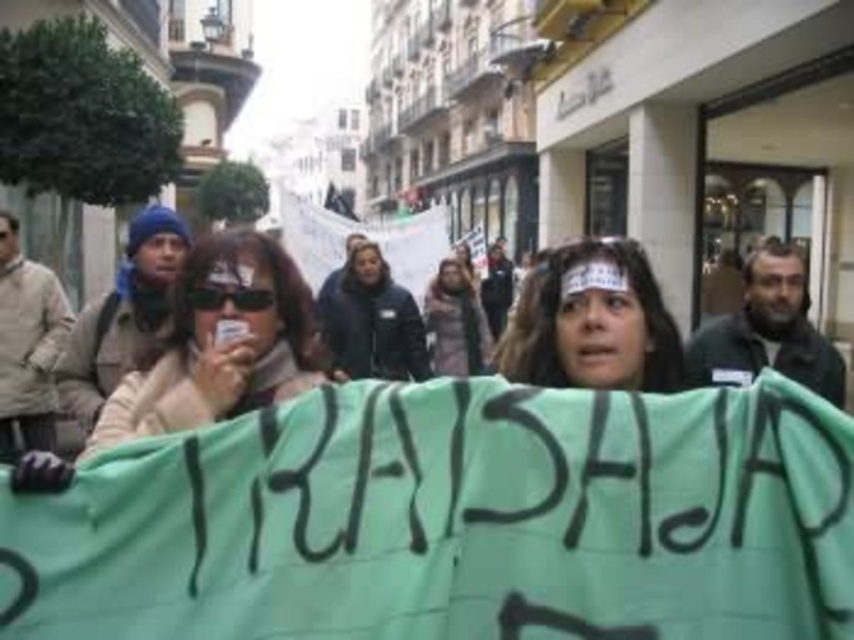
Is matte beige jacket at center further to the viewer compared to dark brown leather jacket at center?

No.

Does matte beige jacket at center have a larger size compared to dark brown leather jacket at center?

Incorrect, matte beige jacket at center is not larger than dark brown leather jacket at center.

You are a GUI agent. You are given a task and a screenshot of the screen. Output one action in this format:
    pyautogui.click(x=<x>, y=<y>)
    Task: Click on the matte beige jacket at center
    This screenshot has width=854, height=640.
    Given the screenshot: What is the action you would take?
    pyautogui.click(x=220, y=342)

Find the location of `matte beige jacket at center`. matte beige jacket at center is located at coordinates (220, 342).

Is green fabric headband at center above dark brown leather jacket at center?

Yes.

Does green fabric headband at center have a lesser width compared to dark brown leather jacket at center?

Correct, green fabric headband at center's width is less than dark brown leather jacket at center's.

Locate an element on the screen. The width and height of the screenshot is (854, 640). green fabric headband at center is located at coordinates (594, 321).

Is point (182, 362) less distant than point (519, 342)?

That is True.

Does point (229, 372) come behind point (659, 292)?

No, (229, 372) is closer to viewer.

At what (x,y) coordinates should I click in order to perform the action: click on matte beige jacket at center. Please return your answer as a coordinate pair (x, y). This screenshot has width=854, height=640. Looking at the image, I should click on (220, 342).